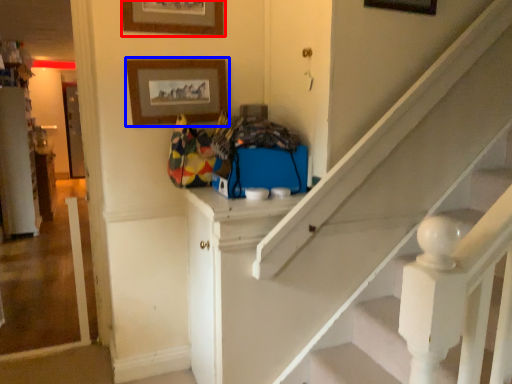
Question: Which object is further to the camera taking this photo, picture frame (highlighted by a red box) or picture frame (highlighted by a blue box)?

Choices:
 (A) picture frame
 (B) picture frame

Answer: (B)